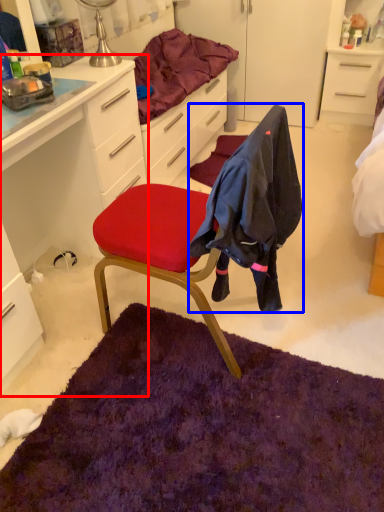
Question: Which object is further to the camera taking this photo, cabinetry (highlighted by a red box) or clothing (highlighted by a blue box)?

Choices:
 (A) cabinetry
 (B) clothing

Answer: (A)